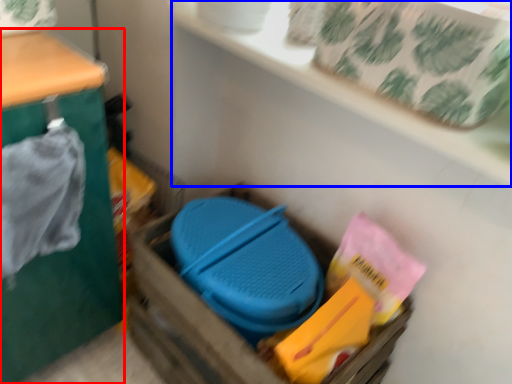
Question: Which object is closer to the camera taking this photo, furniture (highlighted by a red box) or shelf (highlighted by a blue box)?

Choices:
 (A) furniture
 (B) shelf

Answer: (A)